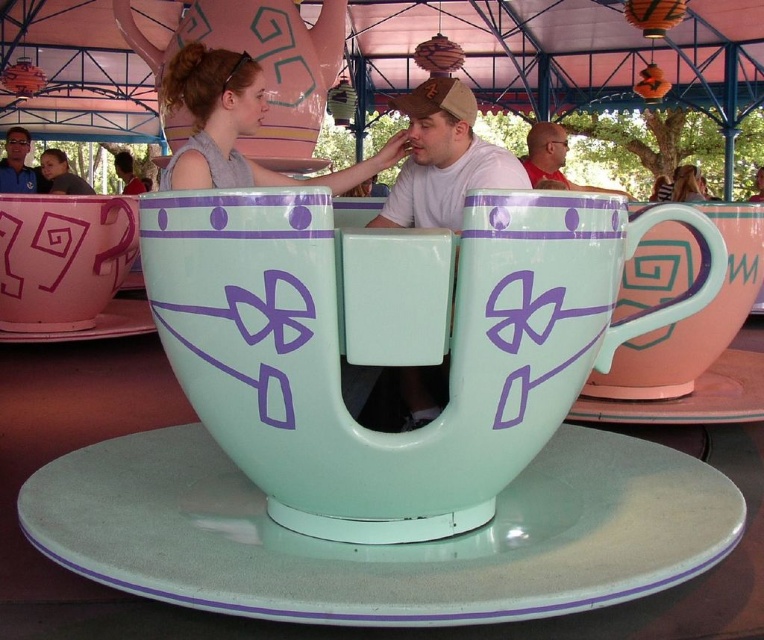
Does red shirt at upper center have a larger size compared to matte brown hair at upper left?

Incorrect, red shirt at upper center is not larger than matte brown hair at upper left.

What do you see at coordinates (552, 157) in the screenshot? Image resolution: width=764 pixels, height=640 pixels. I see `red shirt at upper center` at bounding box center [552, 157].

Locate an element on the screen. This screenshot has height=640, width=764. red shirt at upper center is located at coordinates (552, 157).

Measure the distance from mint green ceramic mug at center to matte pink saucer at lower left.

3.94 meters

Is mint green ceramic mug at center below matte pink saucer at lower left?

Correct, mint green ceramic mug at center is located below matte pink saucer at lower left.

The image size is (764, 640). I want to click on mint green ceramic mug at center, so click(x=392, y=340).

Is red shirt at upper center taller than matte gray hair at upper center?

No, red shirt at upper center is not taller than matte gray hair at upper center.

Can you confirm if red shirt at upper center is bigger than matte gray hair at upper center?

Incorrect, red shirt at upper center is not larger than matte gray hair at upper center.

Is point (554, 141) positioned before point (695, 198)?

That is True.

The width and height of the screenshot is (764, 640). In order to click on red shirt at upper center in this screenshot , I will do `click(552, 157)`.